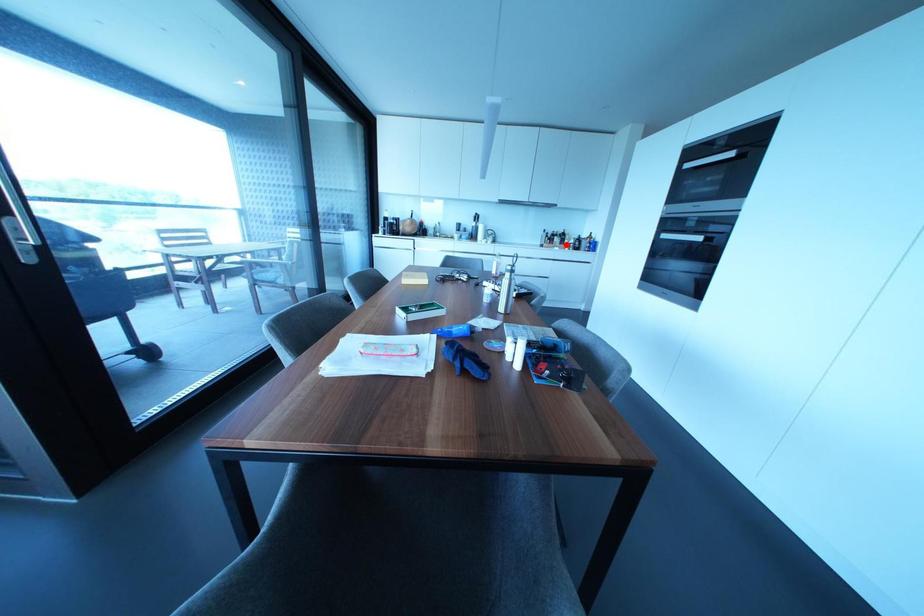
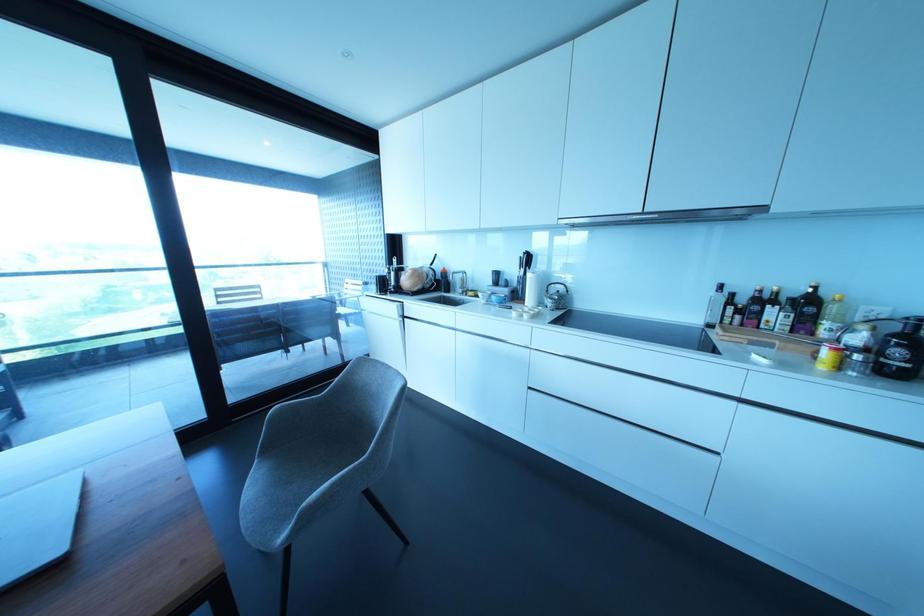
Find the pixel in the second image that matches the highlighted location in the first image.

(825, 353)